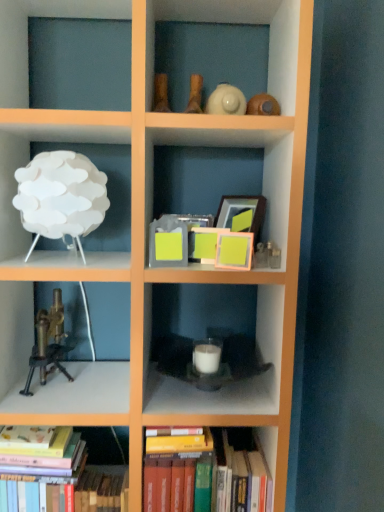
Question: Does point (24, 501) appear closer or farther from the camera than point (233, 476)?

Choices:
 (A) farther
 (B) closer

Answer: (B)

Question: In the image, is hardcover books at lower left, positioned as the first book in left-to-right order, on the left side or the right side of hardcover books at center, the second book viewed from the left?

Choices:
 (A) left
 (B) right

Answer: (A)

Question: Based on their relative distances, which object is farther from the white matte candle at center, marked as the 2th shelf in a top-to-bottom arrangement?

Choices:
 (A) hardcover books at center, positioned as the 1th book in right-to-left order
 (B) brass/bronze microscope at left
 (C) white matte lamp at upper left, placed as the second shelf when sorted from bottom to top
 (D) hardcover books at lower left, positioned as the first book in left-to-right order

Answer: (C)

Question: Which object is the closest to the hardcover books at lower left, acting as the 2th book starting from the right?

Choices:
 (A) white matte candle at center, the first shelf ordered from the bottom
 (B) hardcover books at center, positioned as the 1th book in right-to-left order
 (C) white matte lamp at upper left, placed as the second shelf when sorted from bottom to top
 (D) brass/bronze microscope at left

Answer: (B)